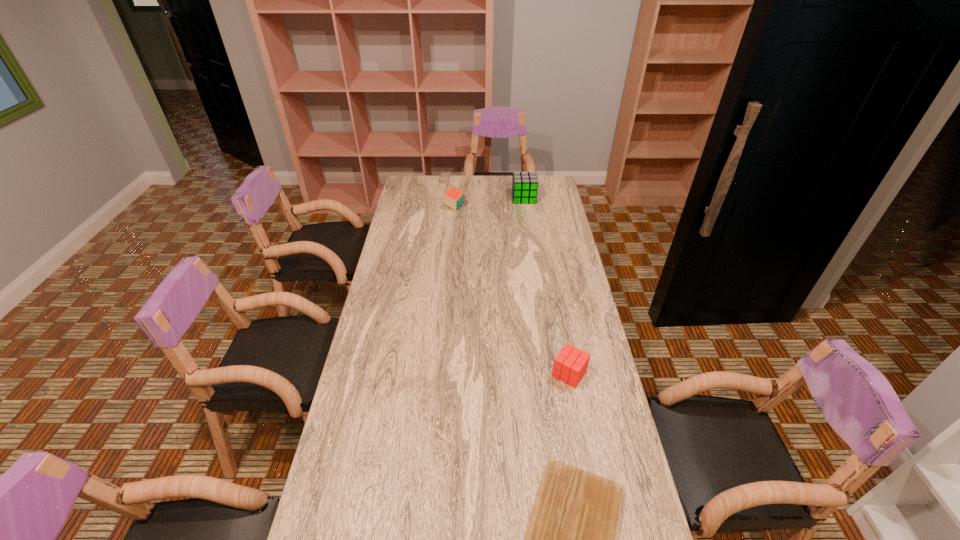
The image size is (960, 540). I want to click on the tallest object, so click(x=524, y=184).

Locate an element on the screen. the leftmost cube is located at coordinates (454, 198).

I want to click on the third tallest object, so click(x=570, y=365).

This screenshot has height=540, width=960. In order to click on the nearest cube in this screenshot , I will do `click(570, 365)`.

Where is `free space located on the left of the tallest object`? This screenshot has width=960, height=540. free space located on the left of the tallest object is located at coordinates (464, 198).

Locate an element on the screen. vacant space located on the right of the leftmost object is located at coordinates (509, 207).

This screenshot has height=540, width=960. Find the location of `vacant space located 0.050m on the left of the second nearest object`. vacant space located 0.050m on the left of the second nearest object is located at coordinates (536, 374).

Locate an element on the screen. object that is at the far edge is located at coordinates (524, 184).

You are a GUI agent. You are given a task and a screenshot of the screen. Output one action in this format:
    pyautogui.click(x=<x>, y=<y>)
    Task: Click on the object positioned at the far right corner
    The height and width of the screenshot is (540, 960).
    Given the screenshot: What is the action you would take?
    pyautogui.click(x=524, y=184)

This screenshot has width=960, height=540. I want to click on vacant space at the left edge of the desktop, so click(415, 215).